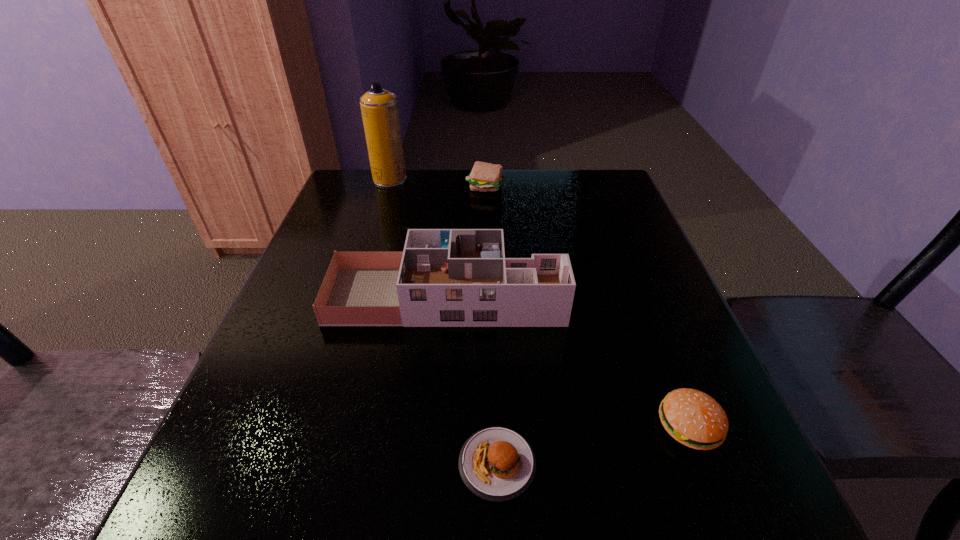
At what (x,y) coordinates should I click in order to perform the action: click on aerosol can. Please return your answer as a coordinate pair (x, y). This screenshot has height=540, width=960. Looking at the image, I should click on (379, 108).

Identify the location of the fourth shortest object. The width and height of the screenshot is (960, 540). (444, 277).

Where is `dollhouse`? The image size is (960, 540). dollhouse is located at coordinates (444, 277).

Where is `the farthest food`? the farthest food is located at coordinates (485, 177).

You are a GUI agent. You are given a task and a screenshot of the screen. Output one action in this format:
    pyautogui.click(x=<x>, y=<y>)
    Task: Click on the second tallest food
    The width and height of the screenshot is (960, 540).
    Given the screenshot: What is the action you would take?
    pyautogui.click(x=693, y=418)

Where is `the fourth tallest object`? The image size is (960, 540). the fourth tallest object is located at coordinates (693, 418).

You are a GUI agent. You are given a task and a screenshot of the screen. Output one action in this format:
    pyautogui.click(x=<x>, y=<y>)
    Task: Click on the shortest food
    This screenshot has height=540, width=960.
    Given the screenshot: What is the action you would take?
    pyautogui.click(x=498, y=464)

Where is `free space located 0.310m on the right of the aerosol can`? This screenshot has width=960, height=540. free space located 0.310m on the right of the aerosol can is located at coordinates (512, 179).

The image size is (960, 540). I want to click on free space located at the entrance of the second tallest object, so click(624, 296).

Where is `free location located on the front of the farthest food`? free location located on the front of the farthest food is located at coordinates (486, 221).